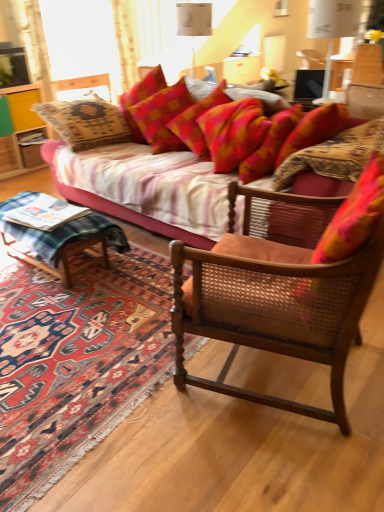
The height and width of the screenshot is (512, 384). Identify the location of vacant space in front of wooden cane chair at center. (273, 463).